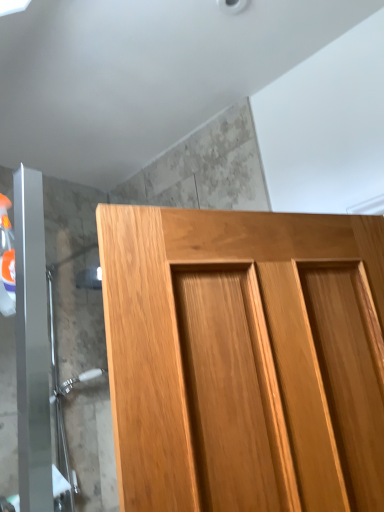
Question: Considering the relative positions of light brown wood door at center and satin nickel shower door at lower left in the image provided, is light brown wood door at center to the left or to the right of satin nickel shower door at lower left?

Choices:
 (A) left
 (B) right

Answer: (B)

Question: Based on their sizes in the image, would you say light brown wood door at center is bigger or smaller than satin nickel shower door at lower left?

Choices:
 (A) big
 (B) small

Answer: (A)

Question: From the image's perspective, relative to satin nickel shower door at lower left, is light brown wood door at center above or below?

Choices:
 (A) above
 (B) below

Answer: (A)

Question: From a real-world perspective, relative to light brown wood door at center, is satin nickel shower door at lower left vertically above or below?

Choices:
 (A) above
 (B) below

Answer: (A)

Question: Is point (49, 282) closer or farther from the camera than point (119, 291)?

Choices:
 (A) closer
 (B) farther

Answer: (B)

Question: In the image, is satin nickel shower door at lower left on the left side or the right side of light brown wood door at center?

Choices:
 (A) right
 (B) left

Answer: (B)

Question: In terms of size, does satin nickel shower door at lower left appear bigger or smaller than light brown wood door at center?

Choices:
 (A) big
 (B) small

Answer: (B)